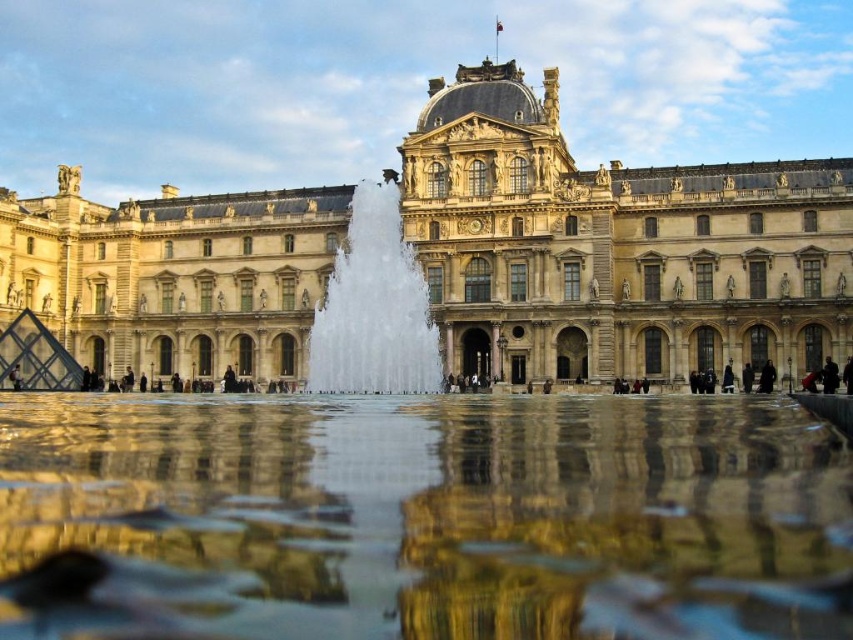
Question: Which is farther from the clear water fountain at center?

Choices:
 (A) clear glass water at center
 (B) beige stone palace at center

Answer: (A)

Question: Can you confirm if beige stone palace at center is thinner than clear water fountain at center?

Choices:
 (A) no
 (B) yes

Answer: (A)

Question: Among these objects, which one is nearest to the camera?

Choices:
 (A) clear water fountain at center
 (B) beige stone palace at center

Answer: (B)

Question: Which object is the closest to the clear water fountain at center?

Choices:
 (A) clear glass water at center
 (B) beige stone palace at center

Answer: (B)

Question: Can you confirm if clear glass water at center is smaller than clear water fountain at center?

Choices:
 (A) yes
 (B) no

Answer: (A)

Question: From the image, what is the correct spatial relationship of beige stone palace at center in relation to clear water fountain at center?

Choices:
 (A) above
 (B) below

Answer: (A)